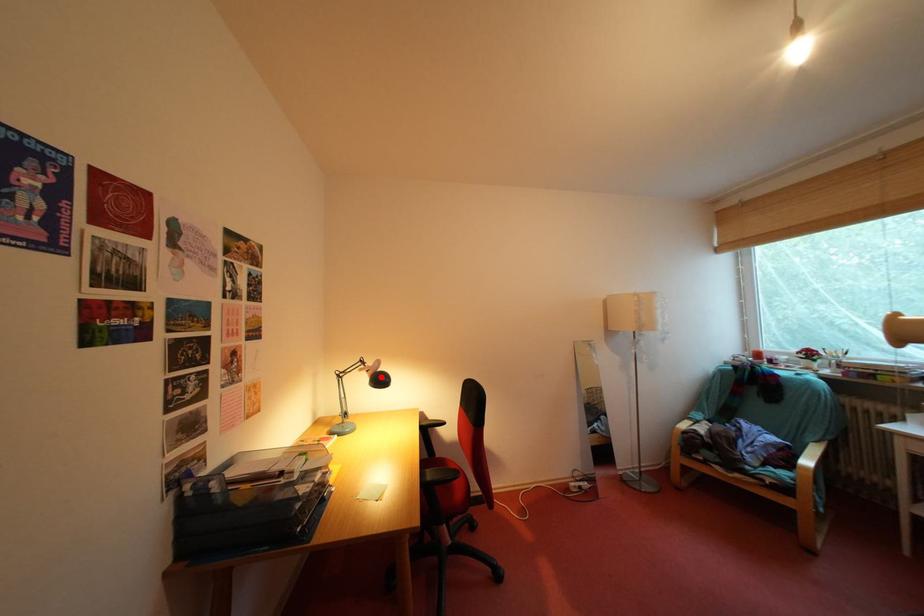
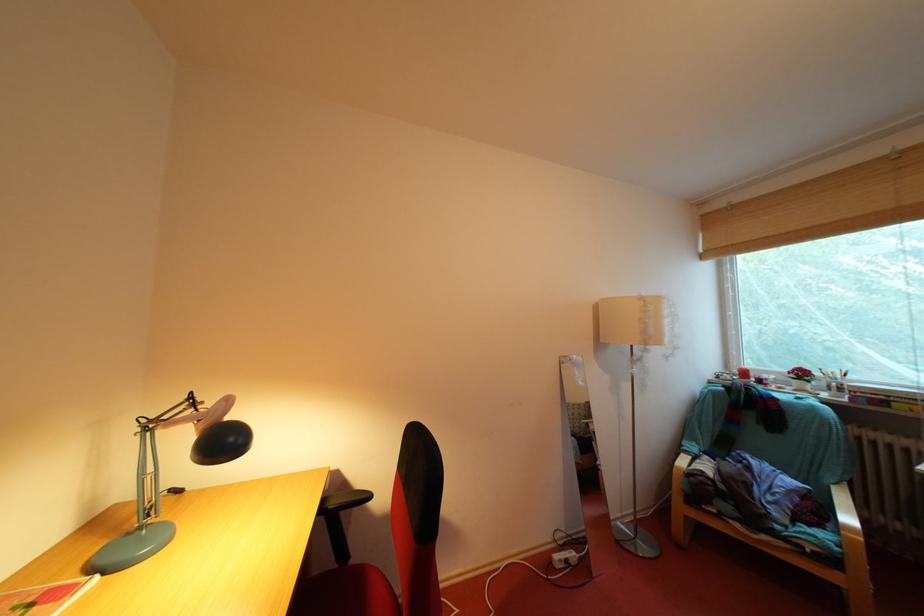
Find the pixel in the second image that matches the highlighted location in the first image.

(215, 429)